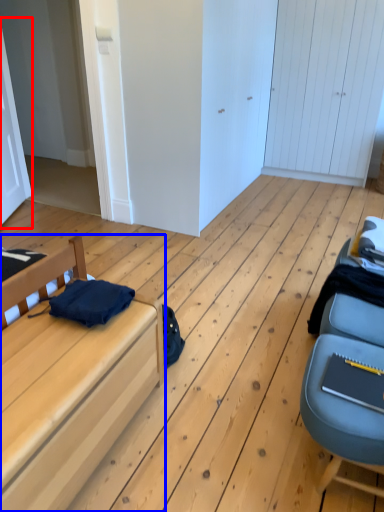
Question: Which object appears closest to the camera in this image, door (highlighted by a red box) or furniture (highlighted by a blue box)?

Choices:
 (A) door
 (B) furniture

Answer: (B)